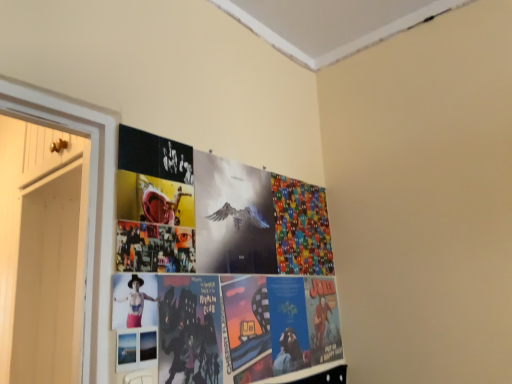
Question: Is matte black person at center shorter than white wood door at left?

Choices:
 (A) yes
 (B) no

Answer: (A)

Question: From the image's perspective, is matte black person at center above white wood door at left?

Choices:
 (A) no
 (B) yes

Answer: (B)

Question: From the image's perspective, is matte black person at center beneath white wood door at left?

Choices:
 (A) no
 (B) yes

Answer: (A)

Question: Does matte black person at center lie behind white wood door at left?

Choices:
 (A) no
 (B) yes

Answer: (A)

Question: From a real-world perspective, is matte black person at center located beneath white wood door at left?

Choices:
 (A) yes
 (B) no

Answer: (A)

Question: Can you confirm if matte black person at center is wider than white wood door at left?

Choices:
 (A) no
 (B) yes

Answer: (A)

Question: Does matte black person at center have a smaller size compared to metallic silver poster at center, the second flyer when ordered from right to left?

Choices:
 (A) yes
 (B) no

Answer: (A)

Question: Would you say matte black person at center contains metallic silver poster at center, the second flyer when ordered from right to left?

Choices:
 (A) yes
 (B) no

Answer: (B)

Question: Is matte black person at center shorter than metallic silver poster at center, the second flyer when ordered from right to left?

Choices:
 (A) yes
 (B) no

Answer: (A)

Question: From a real-world perspective, is matte black person at center positioned over metallic silver poster at center, which ranks as the second flyer in back-to-front order, based on gravity?

Choices:
 (A) yes
 (B) no

Answer: (B)

Question: Does matte black person at center have a greater height compared to metallic silver poster at center, marked as the first flyer in a left-to-right arrangement?

Choices:
 (A) no
 (B) yes

Answer: (A)

Question: Is matte black person at center next to metallic silver poster at center, marked as the first flyer in a left-to-right arrangement, and touching it?

Choices:
 (A) no
 (B) yes

Answer: (A)

Question: From the image's perspective, is white wood door at left beneath multicolored fabric at upper right, which is the second flyer in front-to-back order?

Choices:
 (A) no
 (B) yes

Answer: (B)